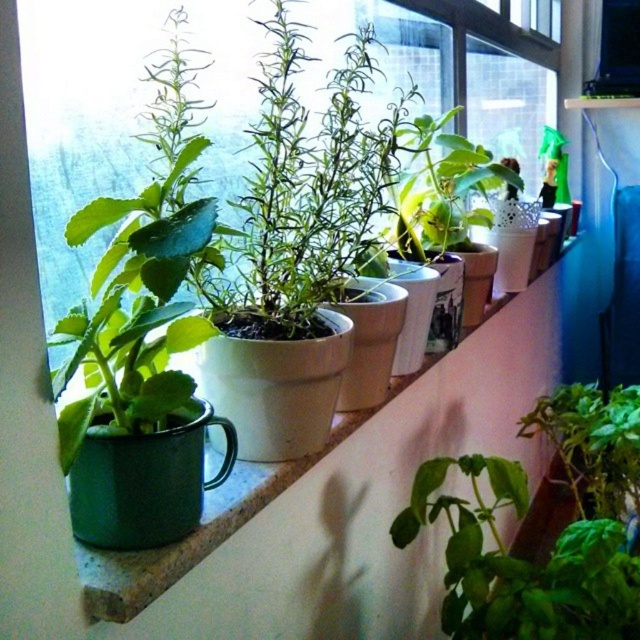
Who is more forward, [544,417] or [426,216]?

Point [426,216]

The width and height of the screenshot is (640, 640). Describe the element at coordinates (593, 444) in the screenshot. I see `green matte leafy plant at center` at that location.

Between point (600, 396) and point (401, 198), which one is positioned behind?

Positioned behind is point (600, 396).

This screenshot has width=640, height=640. In order to click on green matte leafy plant at center in this screenshot , I will do `click(593, 444)`.

Between green ceramic mug at left and green matte leafy plant at center, which one appears on the right side from the viewer's perspective?

From the viewer's perspective, green matte leafy plant at center appears more on the right side.

Who is higher up, green ceramic mug at left or green matte leafy plant at center?

green ceramic mug at left is above.

Is point (260, 502) closer to camera compared to point (564, 413)?

Yes, point (260, 502) is in front of point (564, 413).

At what (x,y) coordinates should I click in order to perform the action: click on green ceramic mug at left. Please return your answer as a coordinate pair (x, y). The width and height of the screenshot is (640, 640). Looking at the image, I should click on (204, 525).

Does green ceramic mug at left appear over green matte plant at center?

No.

Is point (541, 257) behind point (408, 234)?

Yes.

Locate an element on the screen. This screenshot has width=640, height=640. green ceramic mug at left is located at coordinates (204, 525).